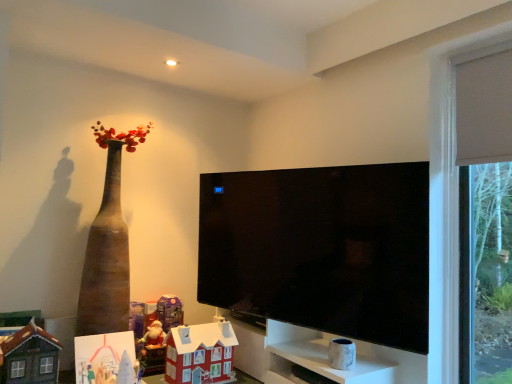
Question: Considering the relative positions of matte purple toy at lower center, which is counted as the third toy, starting from the right, and white marble cabinet at lower right in the image provided, is matte purple toy at lower center, which is counted as the third toy, starting from the right, to the right of white marble cabinet at lower right from the viewer's perspective?

Choices:
 (A) yes
 (B) no

Answer: (B)

Question: From a real-world perspective, is matte purple toy at lower center, which is counted as the third toy, starting from the right, below white marble cabinet at lower right?

Choices:
 (A) no
 (B) yes

Answer: (A)

Question: Does matte purple toy at lower center, the fourth toy in the left-to-right sequence, have a lesser height compared to white marble cabinet at lower right?

Choices:
 (A) no
 (B) yes

Answer: (A)

Question: Can you confirm if matte purple toy at lower center, the fourth toy in the left-to-right sequence, is bigger than white marble cabinet at lower right?

Choices:
 (A) no
 (B) yes

Answer: (A)

Question: From the image's perspective, is matte purple toy at lower center, the fourth toy in the left-to-right sequence, over white marble cabinet at lower right?

Choices:
 (A) no
 (B) yes

Answer: (B)

Question: From a real-world perspective, relative to cardboard house at center, positioned as the second toy in right-to-left order, is matte purple toy at lower center, the fourth toy in the left-to-right sequence, vertically above or below?

Choices:
 (A) below
 (B) above

Answer: (B)

Question: From the image's perspective, relative to cardboard house at center, arranged as the fifth toy when viewed from the left, is matte purple toy at lower center, which is counted as the third toy, starting from the right, above or below?

Choices:
 (A) above
 (B) below

Answer: (A)

Question: Is matte purple toy at lower center, the fourth toy in the left-to-right sequence, wider or thinner than cardboard house at center, arranged as the fifth toy when viewed from the left?

Choices:
 (A) thin
 (B) wide

Answer: (A)

Question: Is point (174, 299) closer or farther from the camera than point (219, 350)?

Choices:
 (A) closer
 (B) farther

Answer: (B)

Question: Which is correct: cardboard house at center, arranged as the fifth toy when viewed from the left, is inside matte plastic santa at lower left, which is counted as the 3th toy, starting from the left, or outside of it?

Choices:
 (A) outside
 (B) inside

Answer: (A)

Question: Is cardboard house at center, arranged as the fifth toy when viewed from the left, taller or shorter than matte plastic santa at lower left, positioned as the 4th toy in right-to-left order?

Choices:
 (A) short
 (B) tall

Answer: (B)

Question: From a real-world perspective, is cardboard house at center, arranged as the fifth toy when viewed from the left, above or below matte plastic santa at lower left, which is counted as the 3th toy, starting from the left?

Choices:
 (A) above
 (B) below

Answer: (A)

Question: From the image's perspective, is cardboard house at center, arranged as the fifth toy when viewed from the left, positioned above or below matte plastic santa at lower left, which is counted as the 3th toy, starting from the left?

Choices:
 (A) below
 (B) above

Answer: (B)

Question: Based on their positions, is cardboard house at center, positioned as the second toy in right-to-left order, located to the left or right of matte white curtain at right?

Choices:
 (A) left
 (B) right

Answer: (A)

Question: Choose the correct answer: Is cardboard house at center, arranged as the fifth toy when viewed from the left, inside matte white curtain at right or outside it?

Choices:
 (A) inside
 (B) outside

Answer: (B)